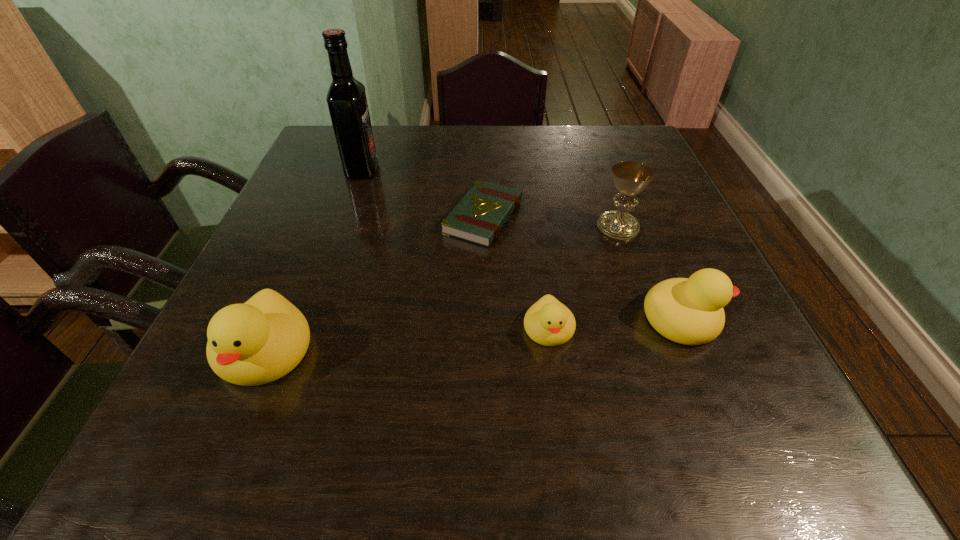
This screenshot has height=540, width=960. I want to click on location for an additional duckling to make spacing equal, so click(x=410, y=340).